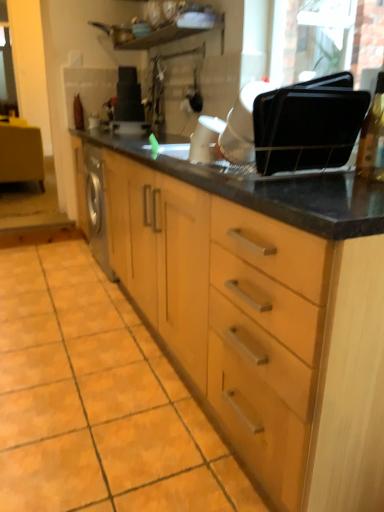
Question: Does black matte toaster at upper center, which is the third appliance from front to back, lie behind black plastic trays at upper right, the 3th appliance positioned from the left?

Choices:
 (A) yes
 (B) no

Answer: (A)

Question: From the image's perspective, does black matte toaster at upper center, which appears as the 1th appliance when viewed from the top, appear higher than black plastic trays at upper right, the 3th appliance positioned from the left?

Choices:
 (A) yes
 (B) no

Answer: (A)

Question: Considering the relative positions of black matte toaster at upper center, which is the third appliance from front to back, and black plastic trays at upper right, arranged as the 1th appliance when ordered from the bottom, in the image provided, is black matte toaster at upper center, which is the third appliance from front to back, to the left of black plastic trays at upper right, arranged as the 1th appliance when ordered from the bottom, from the viewer's perspective?

Choices:
 (A) yes
 (B) no

Answer: (A)

Question: Can you confirm if black matte toaster at upper center, which is the third appliance from front to back, is smaller than black plastic trays at upper right, marked as the first appliance in a right-to-left arrangement?

Choices:
 (A) no
 (B) yes

Answer: (A)

Question: Can you confirm if black matte toaster at upper center, which appears as the 1th appliance when viewed from the top, is positioned to the right of black plastic trays at upper right, the third appliance in the top-to-bottom sequence?

Choices:
 (A) no
 (B) yes

Answer: (A)

Question: Is point (117, 109) positioned closer to the camera than point (230, 133)?

Choices:
 (A) closer
 (B) farther

Answer: (B)

Question: From a real-world perspective, is black matte toaster at upper center, the first appliance in the left-to-right sequence, physically located above or below white glossy coffee maker at center, placed as the second appliance when sorted from right to left?

Choices:
 (A) below
 (B) above

Answer: (B)

Question: Visually, is black matte toaster at upper center, the 3th appliance positioned from the right, positioned to the left or to the right of white glossy coffee maker at center, the 2th appliance when ordered from bottom to top?

Choices:
 (A) right
 (B) left

Answer: (B)

Question: Is black matte toaster at upper center, which appears as the 1th appliance when viewed from the top, taller or shorter than white glossy coffee maker at center, placed as the 2th appliance when sorted from top to bottom?

Choices:
 (A) short
 (B) tall

Answer: (B)

Question: From the image's perspective, is orange matte tile at lower left above or below white glossy coffee maker at center, the 2th appliance when ordered from back to front?

Choices:
 (A) above
 (B) below

Answer: (B)

Question: Based on their sizes in the image, would you say orange matte tile at lower left is bigger or smaller than white glossy coffee maker at center, the 2th appliance when ordered from back to front?

Choices:
 (A) small
 (B) big

Answer: (B)

Question: Considering the positions of orange matte tile at lower left and white glossy coffee maker at center, the 2th appliance when ordered from bottom to top, in the image, is orange matte tile at lower left taller or shorter than white glossy coffee maker at center, the 2th appliance when ordered from bottom to top,?

Choices:
 (A) tall
 (B) short

Answer: (B)

Question: Is point (119, 426) positioned closer to the camera than point (240, 154)?

Choices:
 (A) closer
 (B) farther

Answer: (B)

Question: Choose the correct answer: Is orange matte tile at lower left inside matte wood vanity at left or outside it?

Choices:
 (A) outside
 (B) inside

Answer: (A)

Question: In terms of width, does orange matte tile at lower left look wider or thinner when compared to matte wood vanity at left?

Choices:
 (A) wide
 (B) thin

Answer: (A)